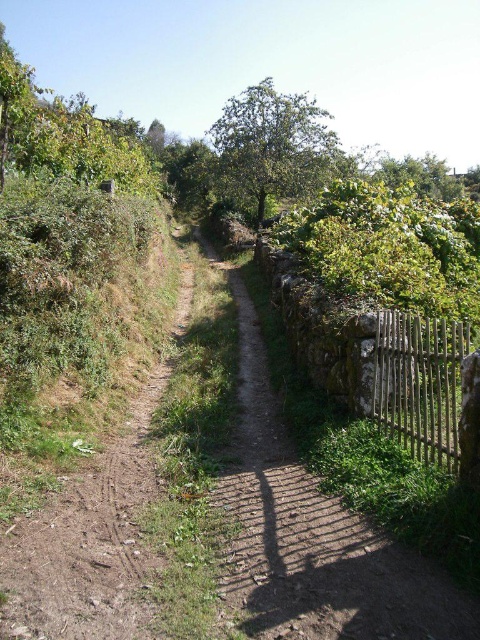
Who is more distant from viewer, (374, 572) or (327, 145)?

The point (327, 145) is more distant.

Is point (294, 621) positioned behind point (244, 179)?

No.

Find the location of a particular element. Image resolution: width=480 pixels, height=640 pixels. dirt path at center is located at coordinates (317, 536).

Where is `dirt path at center`? The height and width of the screenshot is (640, 480). dirt path at center is located at coordinates (317, 536).

Is point (442, 381) farther from camera compared to point (218, 166)?

No, it is not.

Where is `wooden fence at right`? This screenshot has height=640, width=480. wooden fence at right is located at coordinates (420, 384).

Describe the element at coordinates (317, 536) in the screenshot. The width and height of the screenshot is (480, 640). I see `dirt path at center` at that location.

Between dirt path at center and wooden fence at right, which one is positioned lower?

dirt path at center is lower down.

Which is in front, point (369, 604) or point (456, 385)?

Point (369, 604) is in front.

Where is `dirt path at center`? dirt path at center is located at coordinates (317, 536).